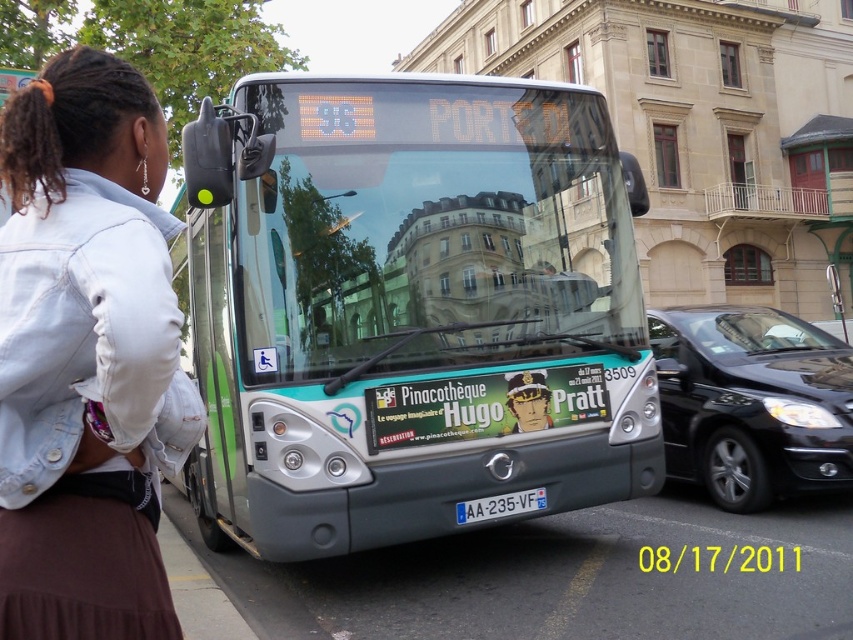
You are a GUI agent. You are given a task and a screenshot of the screen. Output one action in this format:
    pyautogui.click(x=<x>, y=<y>)
    Task: Click on the denim jacket at lower left
    
    Given the screenshot: What is the action you would take?
    pyautogui.click(x=86, y=356)

Is point (33, 404) positioned in front of point (540, 493)?

Yes, it is.

Is point (79, 84) positioned after point (500, 508)?

No, it is not.

Where is `denim jacket at lower left`? The image size is (853, 640). denim jacket at lower left is located at coordinates (86, 356).

Who is taller, denim jacket at lower left or black glossy sedan at center?

With more height is denim jacket at lower left.

Which is above, denim jacket at lower left or black glossy sedan at center?

denim jacket at lower left is above.

Where is `denim jacket at lower left`? This screenshot has height=640, width=853. denim jacket at lower left is located at coordinates (86, 356).

Who is more distant from viewer, (479,417) or (67,253)?

Point (479,417)

Does metallic silver bus at center have a greater width compared to denim jacket at lower left?

Indeed, metallic silver bus at center has a greater width compared to denim jacket at lower left.

Is point (274, 433) closer to camera compared to point (96, 173)?

No, (274, 433) is behind (96, 173).

I want to click on metallic silver bus at center, so click(409, 308).